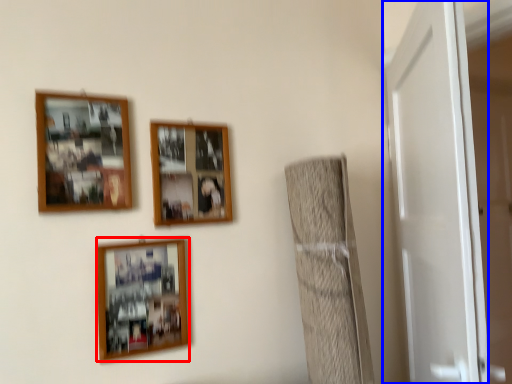
Question: Which object appears farthest to the camera in this image, picture frame (highlighted by a red box) or door (highlighted by a blue box)?

Choices:
 (A) picture frame
 (B) door

Answer: (A)